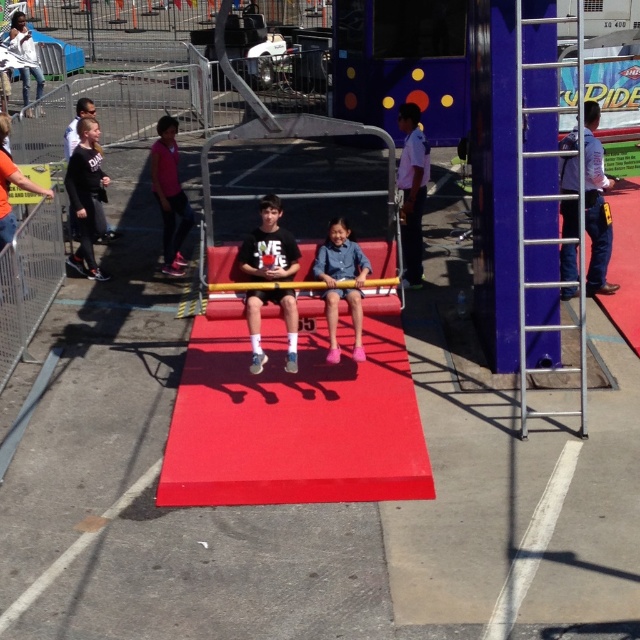
You are a photographer at the fairground. You want to take a photo of the denim shorts at center and the white shirt at center. Which object should you focus on first if you want to capture the smaller one in detail?

The denim shorts at center is smaller than the white shirt at center, so you should focus on the denim shorts at center first to capture the smaller one in detail.

You are standing at the entrance of the fairground and see the white shirt at center and the pink fabric pants at center. Which one is nearer to you?

The white shirt at center is closer to the viewer than the pink fabric pants at center.